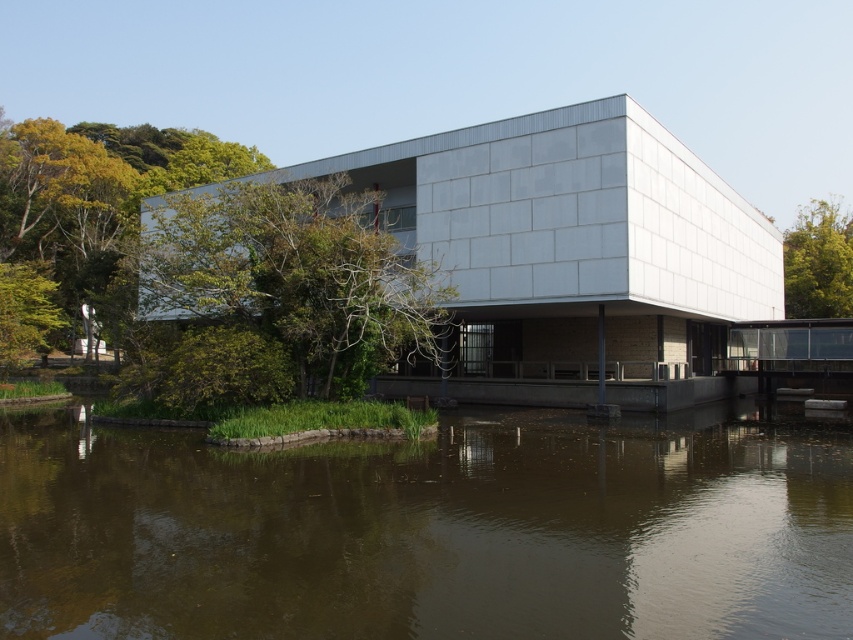
Question: In this image, where is green leafy tree at center located relative to green leafy tree at upper right?

Choices:
 (A) above
 (B) below

Answer: (B)

Question: Estimate the real-world distances between objects in this image. Which object is farther from the green leafy tree at upper right?

Choices:
 (A) brown murky water at lower center
 (B) green leafy tree at center

Answer: (A)

Question: Which of the following is the closest to the observer?

Choices:
 (A) brown murky water at lower center
 (B) green leafy tree at center
 (C) green leafy tree at upper right

Answer: (A)

Question: Does brown murky water at lower center have a lesser width compared to green leafy tree at center?

Choices:
 (A) no
 (B) yes

Answer: (A)

Question: Does brown murky water at lower center have a smaller size compared to green leafy tree at center?

Choices:
 (A) no
 (B) yes

Answer: (B)

Question: Which of the following is the farthest from the observer?

Choices:
 (A) green leafy tree at center
 (B) green leafy tree at upper right
 (C) brown murky water at lower center

Answer: (B)